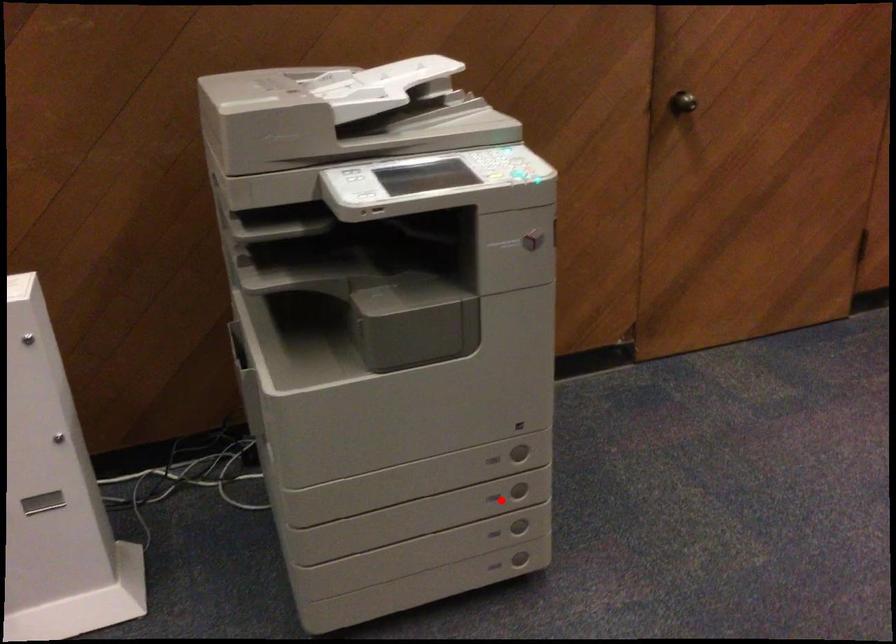
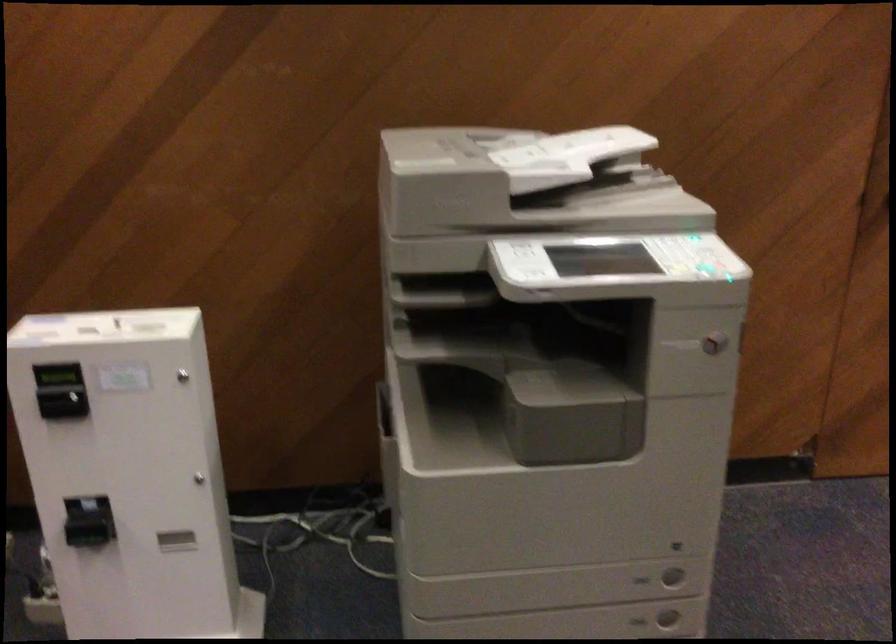
Question: I am providing you with two images of the same scene from different viewpoints. A red point is shown in image1. For the corresponding object point in image2, is it positioned nearer or farther from the camera?

Choices:
 (A) Nearer
 (B) Farther

Answer: (A)